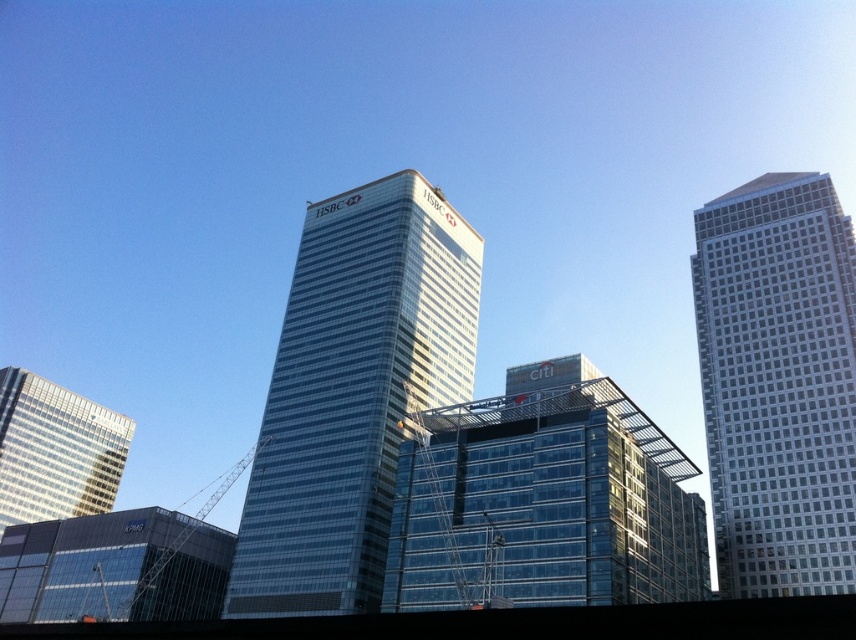
Question: Is the position of white glass skyscraper at right less distant than that of transparent glass building at lower left?

Choices:
 (A) no
 (B) yes

Answer: (B)

Question: Based on their relative distances, which object is farther from the white glass skyscraper at right?

Choices:
 (A) glassy reflective skyscraper at lower left
 (B) transparent glass building at lower left
 (C) transparent glass building at center
 (D) glassy skyscraper at center

Answer: (A)

Question: Which object appears farthest from the camera in this image?

Choices:
 (A) white glass skyscraper at right
 (B) glassy reflective skyscraper at lower left
 (C) glassy skyscraper at center
 (D) transparent glass building at lower left

Answer: (B)

Question: Is white glass skyscraper at right above glassy reflective skyscraper at lower left?

Choices:
 (A) no
 (B) yes

Answer: (B)

Question: Is glassy skyscraper at center thinner than white glass skyscraper at right?

Choices:
 (A) yes
 (B) no

Answer: (B)

Question: Which of these objects is positioned farthest from the glassy skyscraper at center?

Choices:
 (A) transparent glass building at center
 (B) transparent glass building at lower left
 (C) glassy reflective skyscraper at lower left
 (D) white glass skyscraper at right

Answer: (C)